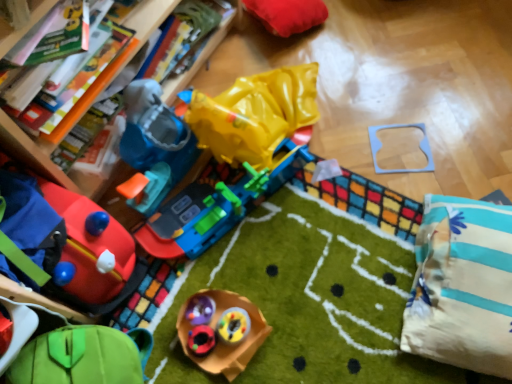
Question: From the image's perspective, is wooden puzzle piece at upper center, the 6th toy when ordered from bottom to top, located above or below white striped pillow at lower right?

Choices:
 (A) below
 (B) above

Answer: (B)

Question: Does point (422, 148) appear closer or farther from the camera than point (458, 215)?

Choices:
 (A) farther
 (B) closer

Answer: (A)

Question: Estimate the real-world distances between objects in this image. Which object is closer to the rubberized plastic toy at center, the fourth toy in the top-to-bottom sequence?

Choices:
 (A) wooden bookshelf at upper left
 (B) wooden puzzle piece at upper center, the 6th toy when ordered from bottom to top
 (C) rubberized red car at lower left, arranged as the third toy when viewed from the top
 (D) rubberized plastic toy at center, which is the third toy from bottom to top
 (E) velvet red cushion at upper center, arranged as the first toy when viewed from the top

Answer: (D)

Question: Which object is positioned closest to the rubberized plastic toy at center, which is the third toy from bottom to top?

Choices:
 (A) rubberized plastic toy at center, the sixth toy from the top
 (B) wooden puzzle piece at upper center, the 2th toy in the top-to-bottom sequence
 (C) rubberized plastic toy at center, the fourth toy in the top-to-bottom sequence
 (D) velvet red cushion at upper center, marked as the seventh toy in a bottom-to-top arrangement
 (E) green fabric toy at lower left, the 7th toy in the top-to-bottom sequence

Answer: (C)